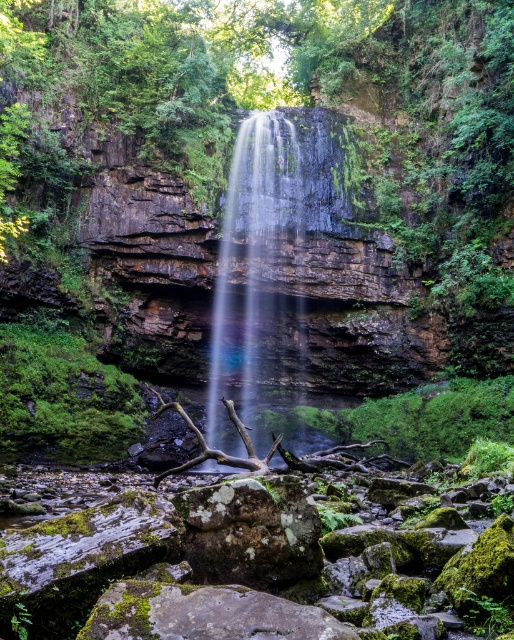
Is point (230, 246) farther from camera compared to point (224, 582)?

Yes.

From the picture: Can you confirm if translucent glass waterfall at center is positioned to the left of green mossy rock at center?

Yes, translucent glass waterfall at center is to the left of green mossy rock at center.

Between point (217, 358) and point (214, 502), which one is positioned behind?

The point (217, 358) is behind.

Image resolution: width=514 pixels, height=640 pixels. Identify the location of translucent glass waterfall at center. (251, 262).

Is point (321, 557) positioned behind point (305, 552)?

Yes, it is.

Between mossy rock at center and green mossy rock at center, which one is positioned lower?

Positioned lower is mossy rock at center.

Which is behind, point (302, 541) or point (211, 506)?

The point (302, 541) is more distant.

Find the location of `mossy rock at center`. mossy rock at center is located at coordinates (234, 566).

Who is more distant from viewer, (x=27, y=611) or (x=292, y=220)?

Positioned behind is point (x=292, y=220).

Can you confirm if mossy rock at center is positioned to the left of translucent glass waterfall at center?

In fact, mossy rock at center is to the right of translucent glass waterfall at center.

What are the coordinates of `mossy rock at center` in the screenshot? It's located at (234, 566).